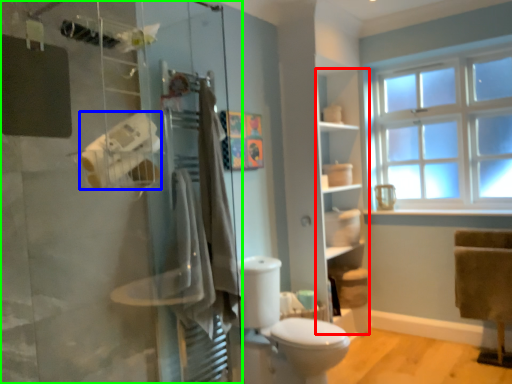
Question: Based on their relative distances, which object is farther from shelf (highlighted by a red box)? Choose from toilet paper (highlighted by a blue box) and shower door (highlighted by a green box).

Choices:
 (A) toilet paper
 (B) shower door

Answer: (A)